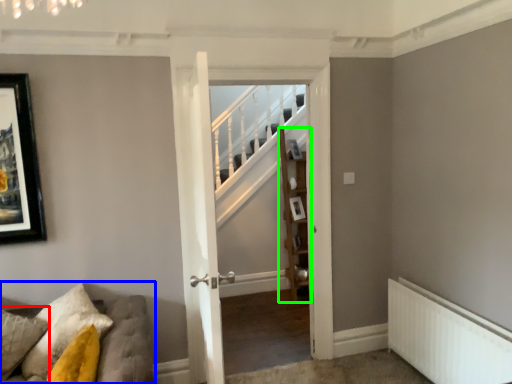
Question: Based on their relative distances, which object is nearer to pillow (highlighted by a red box)? Choose from furniture (highlighted by a blue box) and shelf (highlighted by a green box).

Choices:
 (A) furniture
 (B) shelf

Answer: (A)